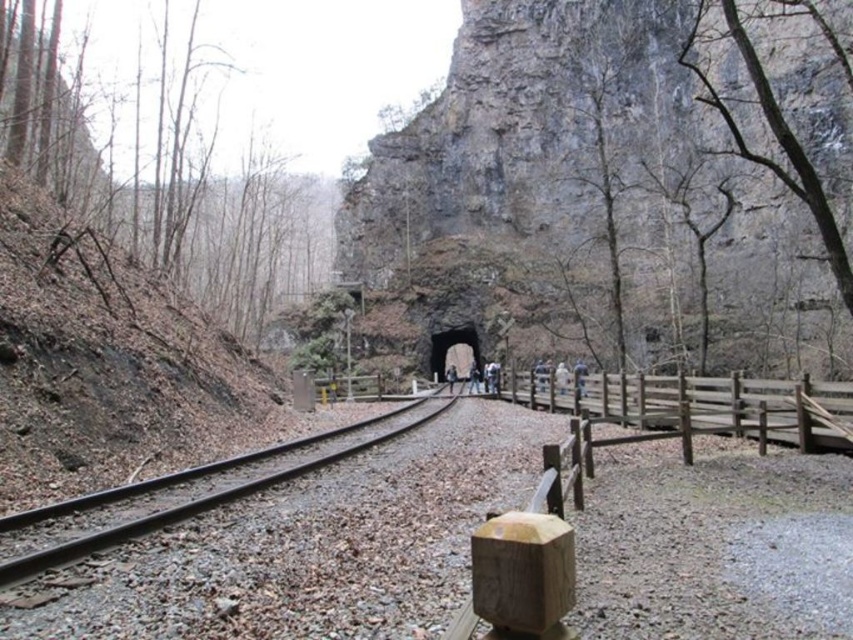
You are standing at the point marked as point (740, 76) on the railway track. The tunnel entrance is 136.58 meters away from you. If you walk straight along the track towards the tunnel, will you reach the tunnel entrance before the wooden fence on your right ends?

The point (740, 76) is 136.58 meters away from the camera. Since the wooden fence is on the right side of the railway track, walking straight towards the tunnel entrance along the track would mean the fence continues alongside you until the tunnel. Therefore, you will reach the tunnel entrance before the wooden fence ends.

You are a hiker who wants to cross the gray rock formation at center and the smooth metal train track at center. Which path would you choose if you want to take the larger one?

The gray rock formation at center is larger in size than the smooth metal train track at center, so you should choose the gray rock formation at center.

You are standing at the tunnel entrance and want to walk towards the point that is closer to you. Which point should you head towards, point (514, 156) or point (437, 408)?

You should head towards point (437, 408) because it is closer to you than point (514, 156) which is further away.